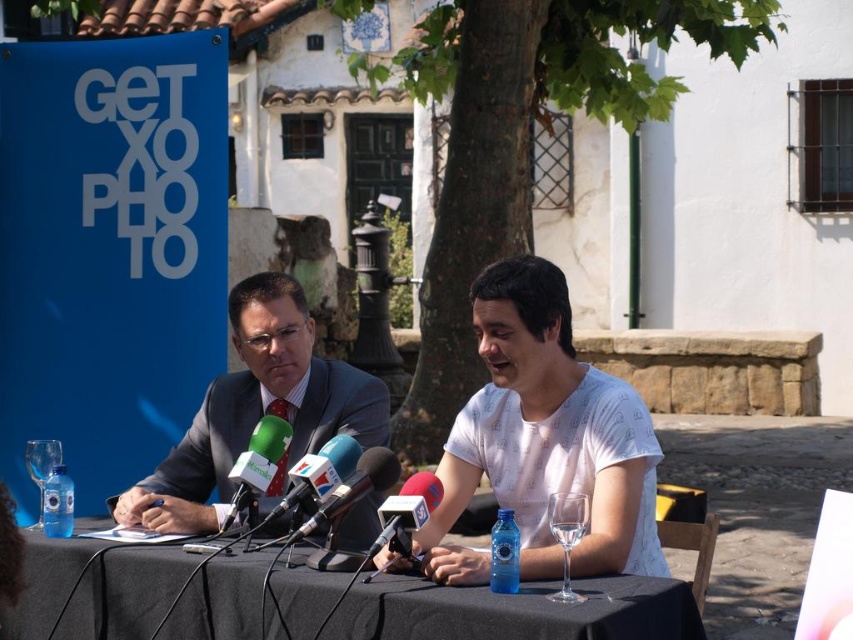
You are a photographer at the press conference. You need to ensure that the white printed shirt at center and the green plastic microphone at center are both clearly visible in your photo. Given their sizes, which one might require you to adjust your camera focus more carefully to avoid blurriness?

The white printed shirt at center is larger in size than the green plastic microphone at center, so the larger size of the white printed shirt at center may require more careful focus adjustment to ensure clarity.